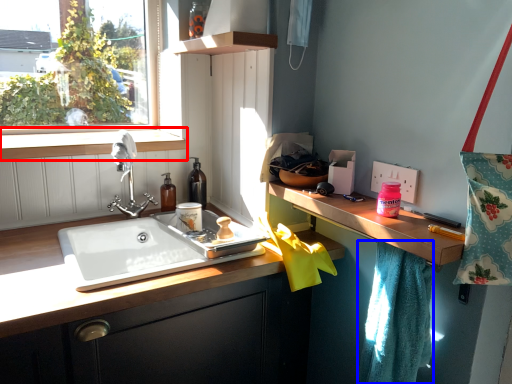
Question: Which object is further to the camera taking this photo, window sill (highlighted by a red box) or bath towel (highlighted by a blue box)?

Choices:
 (A) window sill
 (B) bath towel

Answer: (A)